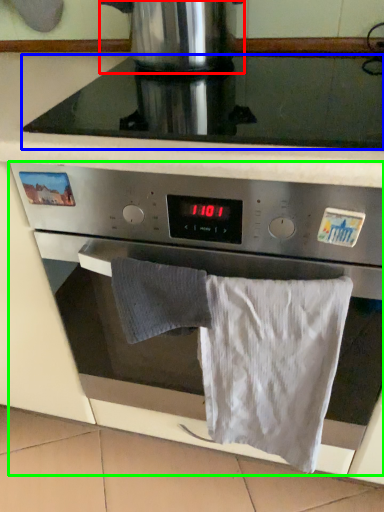
Question: Considering the real-world distances, which object is farthest from kitchen appliance (highlighted by a red box)? gas stove (highlighted by a blue box) or oven (highlighted by a green box)?

Choices:
 (A) gas stove
 (B) oven

Answer: (B)